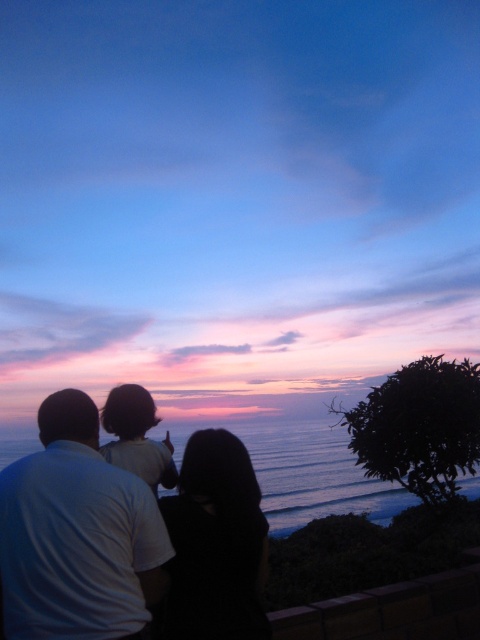
You are standing at the point labeled as point (76,536) in the image. Looking towards the sunset, which direction should you turn to face the white matte shirt at upper left?

The point (76,536) indicates the white matte shirt at upper left, so you are already facing it. No need to turn.

You are a photographer trying to capture the sunset scene. You want to ensure that both the white matte shirt at upper left and the black matte hair at center are in focus. Given that your camera has a depth of field that can cover 18 inches, will both subjects be in focus?

The white matte shirt at upper left and black matte hair at center are 17.83 inches apart from each other, which is within the camera depth of field of 18 inches. Therefore, both subjects will be in focus.

You are one of the figures in the sunset scene. You want to take a photo of the sunset using your phone held at chest level. Which object, the white matte shirt at upper left or the black matte hair at center, would block your view of the sunset if you move forward?

The white matte shirt at upper left is closer to the viewer than the black matte hair at center, so moving forward would cause the white matte shirt at upper left to block your view first.